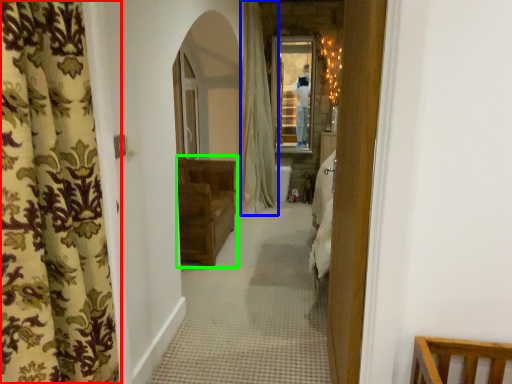
Question: Which object is positioned closest to curtain (highlighted by a red box)? Select from curtain (highlighted by a blue box) and furniture (highlighted by a green box).

Choices:
 (A) curtain
 (B) furniture

Answer: (B)